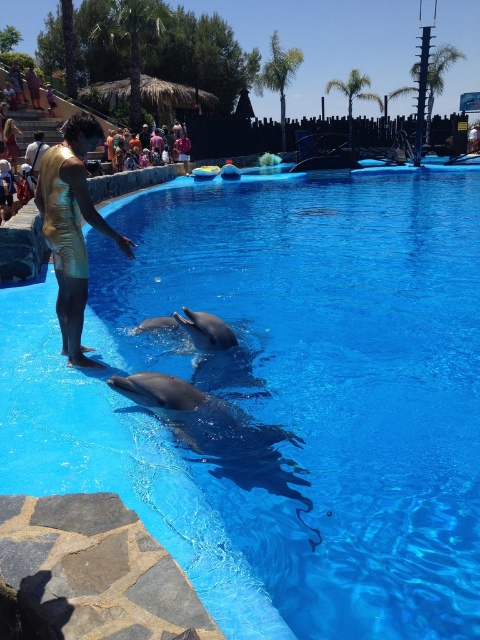
Question: Is gold metallic swimsuit at left to the right of gray smooth dolphin at lower center from the viewer's perspective?

Choices:
 (A) no
 (B) yes

Answer: (A)

Question: Which object is positioned farthest from the gray smooth dolphin at lower center?

Choices:
 (A) smooth gray dolphin at center
 (B) golden fabric dress at lower left

Answer: (B)

Question: Is the position of gold metallic swimsuit at left less distant than that of gray smooth dolphin at center?

Choices:
 (A) yes
 (B) no

Answer: (A)

Question: Can you confirm if gold metallic swimsuit at left is smaller than multicolored fabric crowd at upper center?

Choices:
 (A) no
 (B) yes

Answer: (B)

Question: Which point is closer to the camera taking this photo?

Choices:
 (A) (112, 385)
 (B) (144, 324)
 (C) (15, 156)

Answer: (A)

Question: Among these objects, which one is farthest from the camera?

Choices:
 (A) multicolored fabric crowd at upper center
 (B) gold metallic swimsuit at left
 (C) gray smooth dolphin at center

Answer: (A)